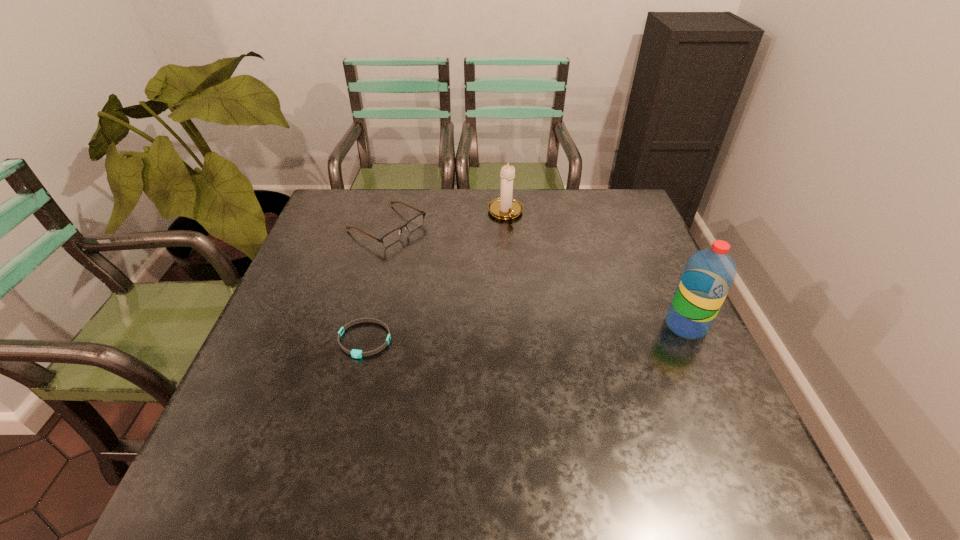
Find the location of a particular element. Image resolution: width=960 pixels, height=540 pixels. unoccupied position between the wristband and the water bottle is located at coordinates (525, 333).

The height and width of the screenshot is (540, 960). I want to click on free spot between the second tallest object and the wristband, so click(x=435, y=276).

Where is `free area in between the wristband and the third tallest object`? Image resolution: width=960 pixels, height=540 pixels. free area in between the wristband and the third tallest object is located at coordinates (375, 283).

Select which object appears as the closest to the water bottle. Please provide its 2D coordinates. Your answer should be formatted as a tuple, i.e. [(x, y)], where the tuple contains the x and y coordinates of a point satisfying the conditions above.

[(505, 207)]

Locate which object ranks second in proximity to the third tallest object. Please provide its 2D coordinates. Your answer should be formatted as a tuple, i.e. [(x, y)], where the tuple contains the x and y coordinates of a point satisfying the conditions above.

[(355, 353)]

Image resolution: width=960 pixels, height=540 pixels. I want to click on vacant area that satisfies the following two spatial constraints: 1. on the front side of the rightmost object; 2. on the front label of the candle holder, so click(514, 325).

At what (x,y) coordinates should I click in order to perform the action: click on free space that satisfies the following two spatial constraints: 1. on the front side of the tallest object; 2. on the front label of the second shortest object. Please return your answer as a coordinate pair (x, y). Image resolution: width=960 pixels, height=540 pixels. Looking at the image, I should click on (360, 325).